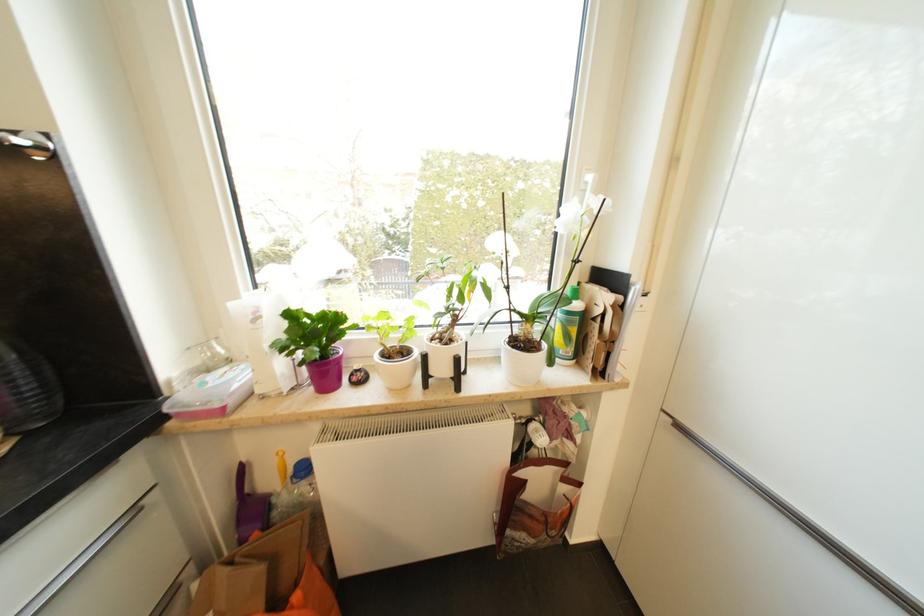
Find where to lift the plastic container lid. Please return your answer as a coordinate pair (x, y).

(27, 387)